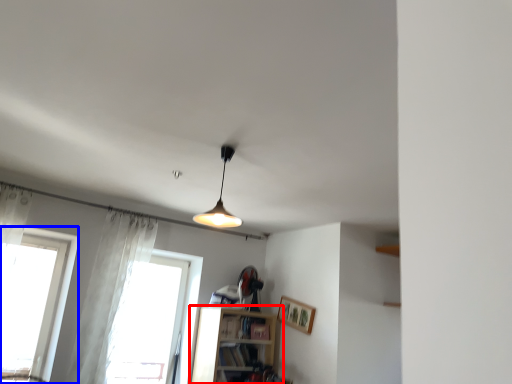
Question: Which object appears closest to the camera in this image, shelf (highlighted by a red box) or window (highlighted by a blue box)?

Choices:
 (A) shelf
 (B) window

Answer: (B)